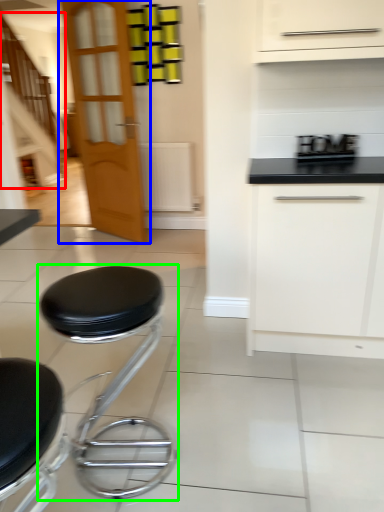
Question: Which is nearer to the stairwell (highlighted by a red box)? door (highlighted by a blue box) or stool (highlighted by a green box).

Choices:
 (A) door
 (B) stool

Answer: (A)